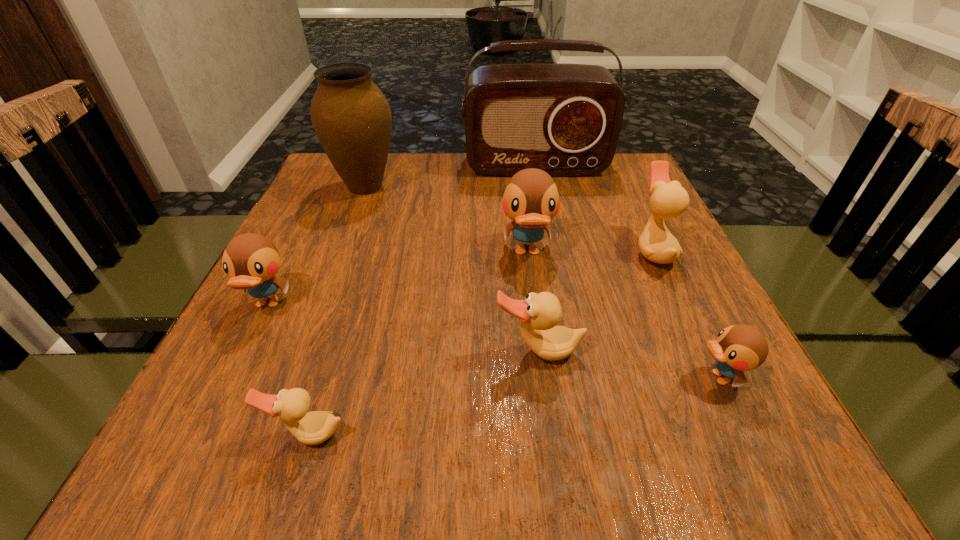
In order to click on free spot between the second farthest tan duck and the urn in this screenshot , I will do `click(452, 269)`.

This screenshot has height=540, width=960. I want to click on empty location between the rightmost blue duck and the biggest tan duck, so click(x=685, y=314).

Locate an element on the screen. The image size is (960, 540). unoccupied position between the leftmost blue duck and the radio receiver is located at coordinates (401, 235).

Find the location of a particular element. This screenshot has height=540, width=960. free spot between the urn and the rightmost tan duck is located at coordinates (509, 219).

Locate an element on the screen. free space between the rightmost blue duck and the rightmost tan duck is located at coordinates (685, 314).

Where is `vacant point located between the leftmost blue duck and the smallest blue duck`? The image size is (960, 540). vacant point located between the leftmost blue duck and the smallest blue duck is located at coordinates (493, 341).

Where is `empty location between the urn and the radio receiver`? empty location between the urn and the radio receiver is located at coordinates (450, 177).

Where is `unoccupied position between the rightmost blue duck and the second blue duck from right to left`? Image resolution: width=960 pixels, height=540 pixels. unoccupied position between the rightmost blue duck and the second blue duck from right to left is located at coordinates (623, 315).

The height and width of the screenshot is (540, 960). I want to click on free space that is in between the smallest tan duck and the brown urn, so click(x=337, y=310).

Find the location of a particular element. The image size is (960, 540). object that is the fourth closest to the leftmost blue duck is located at coordinates (531, 199).